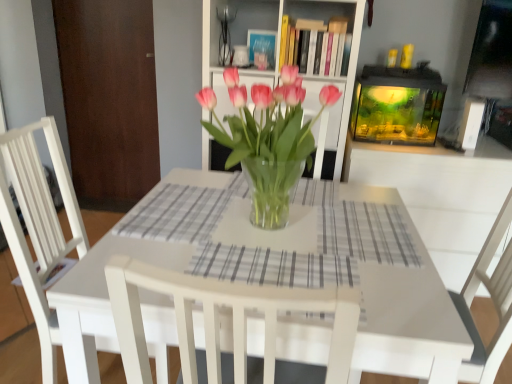
Question: From a real-world perspective, is white wood chair at center physically below gray checkered placemat at center, the 2th plaid in the back-to-front sequence?

Choices:
 (A) no
 (B) yes

Answer: (B)

Question: Is the position of white wood chair at center less distant than that of gray checkered placemat at center, acting as the 1th plaid starting from the front?

Choices:
 (A) yes
 (B) no

Answer: (B)

Question: From the image's perspective, is white wood chair at center located above gray checkered placemat at center, the 2th plaid in the back-to-front sequence?

Choices:
 (A) yes
 (B) no

Answer: (B)

Question: Considering the relative sizes of white wood chair at center and gray checkered placemat at center, marked as the first plaid in a right-to-left arrangement, in the image provided, is white wood chair at center bigger than gray checkered placemat at center, marked as the first plaid in a right-to-left arrangement,?

Choices:
 (A) yes
 (B) no

Answer: (A)

Question: Is white wood chair at center not within gray checkered placemat at center, positioned as the 2th plaid in left-to-right order?

Choices:
 (A) yes
 (B) no

Answer: (A)

Question: From a real-world perspective, relative to gray checkered placemat at center, the 2th plaid in the back-to-front sequence, is gray checkered placemat at center, acting as the second plaid starting from the bottom, vertically above or below?

Choices:
 (A) below
 (B) above

Answer: (B)

Question: Considering the relative positions of gray checkered placemat at center, placed as the first plaid when sorted from top to bottom, and gray checkered placemat at center, acting as the 1th plaid starting from the front, in the image provided, is gray checkered placemat at center, placed as the first plaid when sorted from top to bottom, to the left or to the right of gray checkered placemat at center, acting as the 1th plaid starting from the front,?

Choices:
 (A) left
 (B) right

Answer: (A)

Question: In terms of size, does gray checkered placemat at center, the 1th plaid viewed from the left, appear bigger or smaller than gray checkered placemat at center, acting as the 2th plaid starting from the top?

Choices:
 (A) small
 (B) big

Answer: (A)

Question: Is gray checkered placemat at center, the 1th plaid viewed from the left, inside the boundaries of gray checkered placemat at center, acting as the 2th plaid starting from the top, or outside?

Choices:
 (A) inside
 (B) outside

Answer: (B)

Question: Is translucent glass vase at center in front of or behind transparent glass vase at center in the image?

Choices:
 (A) behind
 (B) front

Answer: (B)

Question: Is point (280, 84) closer or farther from the camera than point (262, 82)?

Choices:
 (A) closer
 (B) farther

Answer: (A)

Question: Is translucent glass vase at center wider or thinner than transparent glass vase at center?

Choices:
 (A) thin
 (B) wide

Answer: (B)

Question: In terms of height, does translucent glass vase at center look taller or shorter compared to transparent glass vase at center?

Choices:
 (A) short
 (B) tall

Answer: (A)

Question: From the image's perspective, is white wood chair at center located above or below brown wood door at left?

Choices:
 (A) above
 (B) below

Answer: (B)

Question: Is white wood chair at center inside or outside of brown wood door at left?

Choices:
 (A) inside
 (B) outside

Answer: (B)